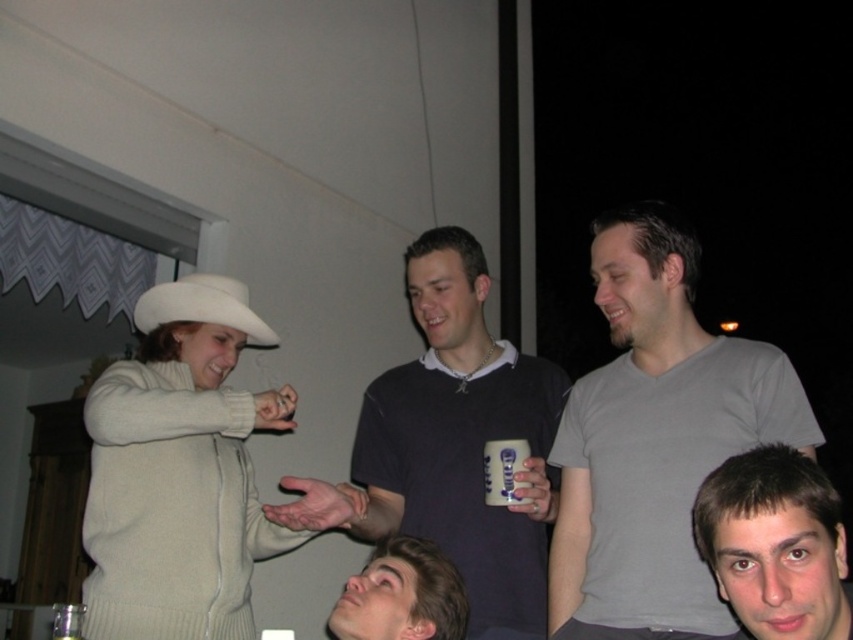
Question: Which object appears closest to the camera in this image?

Choices:
 (A) dark gray sweater at center
 (B) smooth skin face at lower right
 (C) white felt cowboy hat at upper left

Answer: (B)

Question: Can you confirm if smooth skin face at lower right is positioned to the left of white glossy cup at center?

Choices:
 (A) yes
 (B) no

Answer: (B)

Question: Which object is positioned farthest from the smooth skin face at lower right?

Choices:
 (A) white felt cowboy hat at upper left
 (B) gray matte t-shirt at upper right
 (C) smooth skin face at lower center

Answer: (A)

Question: Does white felt cowboy hat at upper left lie in front of white glossy cup at center?

Choices:
 (A) yes
 (B) no

Answer: (B)

Question: Which object is closer to the camera taking this photo?

Choices:
 (A) smooth skin face at lower right
 (B) white felt cowboy hat at upper left
 (C) gray matte t-shirt at upper right

Answer: (A)

Question: Can you confirm if smooth skin face at lower right is wider than smooth skin face at lower center?

Choices:
 (A) yes
 (B) no

Answer: (B)